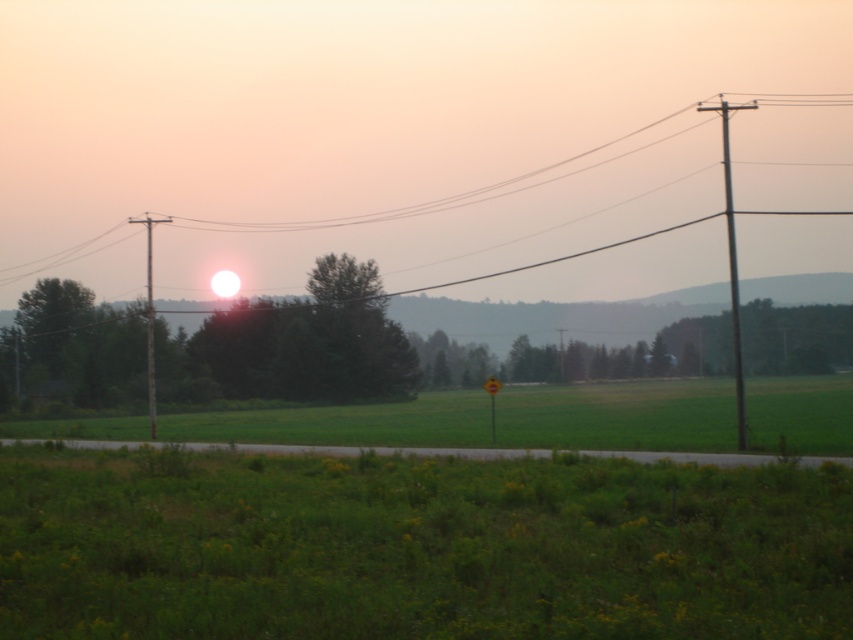
Is metallic wire at upper center closer to the viewer compared to yellow plastic sign at center?

Yes, metallic wire at upper center is closer to the viewer.

Who is lower down, metallic wire at upper center or yellow plastic sign at center?

yellow plastic sign at center is below.

At what (x,y) coordinates should I click in order to perform the action: click on metallic wire at upper center. Please return your answer as a coordinate pair (x, y). Looking at the image, I should click on (422, 202).

Is the position of brown wooden telegraph pole at left more distant than that of yellow plastic sign at center?

Yes.

Is brown wooden telegraph pole at left to the left of yellow plastic sign at center from the viewer's perspective?

Indeed, brown wooden telegraph pole at left is positioned on the left side of yellow plastic sign at center.

Is point (149, 230) farther from camera compared to point (491, 433)?

That is True.

At what (x,y) coordinates should I click in order to perform the action: click on brown wooden telegraph pole at left. Please return your answer as a coordinate pair (x, y). The image size is (853, 640). Looking at the image, I should click on (149, 321).

Which is above, green grassy field at center or yellow plastic sign at center?

yellow plastic sign at center

Is green grassy field at center positioned behind yellow plastic sign at center?

No.

Locate an element on the screen. The width and height of the screenshot is (853, 640). green grassy field at center is located at coordinates (619, 416).

Locate an element on the screen. The height and width of the screenshot is (640, 853). green grassy field at center is located at coordinates (619, 416).